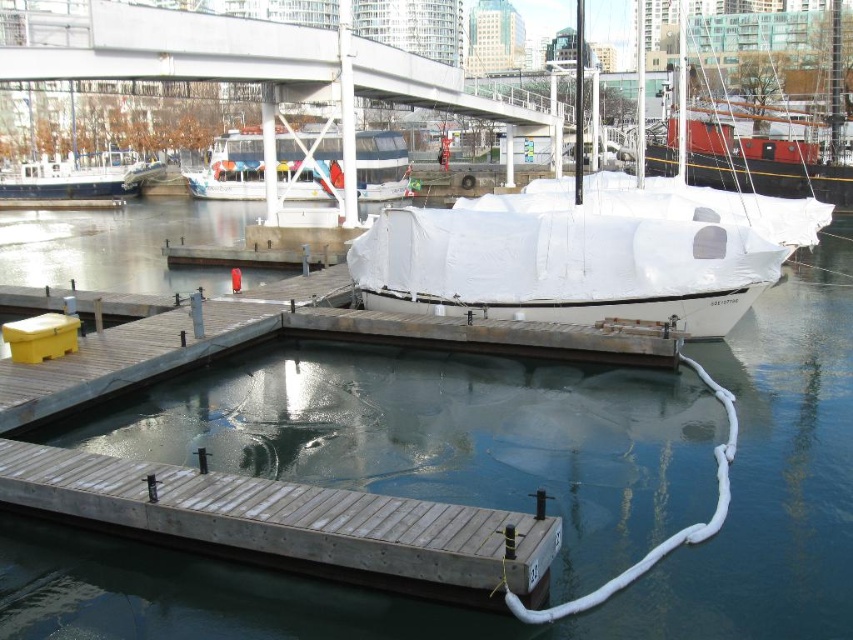
Question: Among these objects, which one is farthest from the camera?

Choices:
 (A) red matte sailboat at upper right
 (B) white tarpaulin boat at center
 (C) white matte boat at center

Answer: (A)

Question: Which point is farther to the camera?

Choices:
 (A) (329, 532)
 (B) (705, 154)
 (C) (561, 211)
 (D) (402, 157)

Answer: (D)

Question: Does white matte boat at center appear over white tarpaulin boat at center?

Choices:
 (A) no
 (B) yes

Answer: (A)

Question: Estimate the real-world distances between objects in this image. Which object is closer to the white tarpaulin boat at center?

Choices:
 (A) wooden dock at lower left
 (B) white matte boat at center
 (C) white glossy boat at center

Answer: (B)

Question: Is red matte sailboat at upper right in front of white glossy boat at center?

Choices:
 (A) no
 (B) yes

Answer: (A)

Question: Can you confirm if white tarpaulin boat at center is bigger than wooden dock at lower left?

Choices:
 (A) yes
 (B) no

Answer: (A)